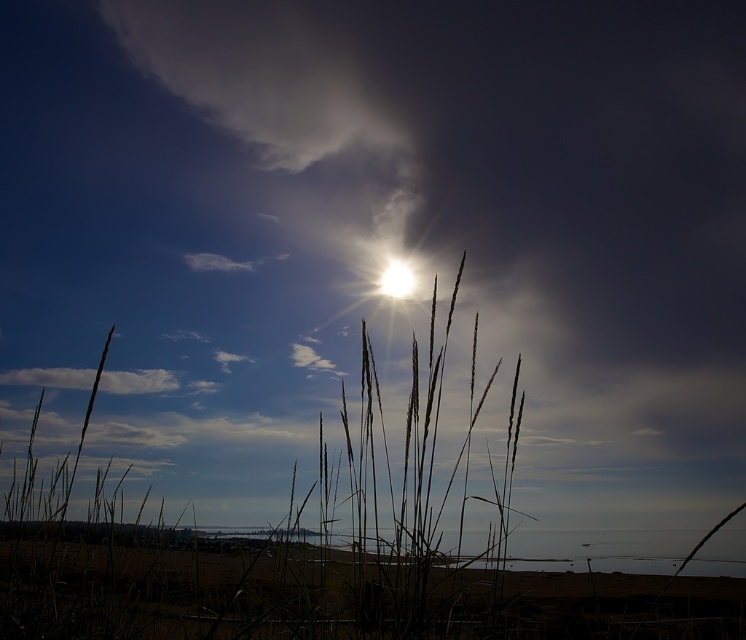
Based on the coordinates provided, which object in the scene is located at point (137, 381)?

The white fluffy cloud at upper left is located at point (137, 381).

You are standing in the serene outdoor scene and want to take a photo of the white fluffy cloud at upper left. If your camera has a focal length of 50mm, what is the minimum distance you need to move closer to the cloud to fill the frame? Assume the camera sensor size is 24mm x 36mm and the cloud occupies 100 pixels in the current image. The answer should be in meters, rounded to two decimal places.

To determine the minimum distance needed, first calculate the current distance to the cloud using the given 6.88 meters. The required distance can be found using the formula for scaling in photography, which involves the ratio of sensor size to the object size in pixels. However, without knowing the actual size of the cloud, it is impossible to accurately calculate the exact distance. Therefore, the information provided is insufficient to answer the question.